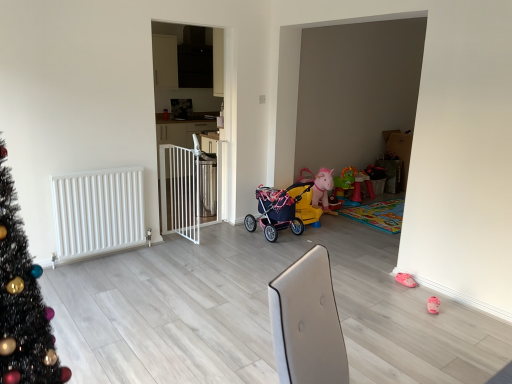
Measure the distance between matte pink stroller at center and camera.

matte pink stroller at center and camera are 4.18 meters apart.

Where is `matte pink stroller at center`? This screenshot has width=512, height=384. matte pink stroller at center is located at coordinates (283, 210).

What is the approximate width of white plastic gate at center?

The width of white plastic gate at center is 8.37 centimeters.

This screenshot has width=512, height=384. What do you see at coordinates (179, 192) in the screenshot?
I see `white plastic gate at center` at bounding box center [179, 192].

Image resolution: width=512 pixels, height=384 pixels. Describe the element at coordinates (305, 203) in the screenshot. I see `pink fabric baby carriage at center` at that location.

Identify the location of white matte radiator at left. (97, 212).

Is white matte radiator at left inside pink fabric baby carriage at center?

No, white matte radiator at left is not surrounded by pink fabric baby carriage at center.

Is point (298, 182) farther from camera compared to point (103, 224)?

Yes, it is.

Does pink fabric baby carriage at center appear on the left side of white matte radiator at left?

Incorrect, pink fabric baby carriage at center is not on the left side of white matte radiator at left.

Between white metal gate at center and matte pink stroller at center, which one appears on the left side from the viewer's perspective?

Positioned to the left is white metal gate at center.

Is white metal gate at center located outside matte pink stroller at center?

Yes.

Locate an element on the screen. The image size is (512, 384). toy below the white metal gate at center (from a real-world perspective) is located at coordinates (283, 210).

From a real-world perspective, which object rests below the other?

From a 3D spatial view, matte pink stroller at center is below.

Is matte pink stroller at center not close to pink fabric baby carriage at center?

No, there isn't a large distance between matte pink stroller at center and pink fabric baby carriage at center.

Would you say matte pink stroller at center is inside or outside pink fabric baby carriage at center?

matte pink stroller at center is not inside pink fabric baby carriage at center, it's outside.

From a real-world perspective, who is located higher, matte pink stroller at center or pink fabric baby carriage at center?

From a 3D spatial view, matte pink stroller at center is above.

Is pink fabric baby carriage at center at the right side of white plastic gate at center?

Indeed, pink fabric baby carriage at center is positioned on the right side of white plastic gate at center.

Which is more distant, (309, 221) or (168, 222)?

The point (309, 221) is farther.

Based on the photo, is pink fabric baby carriage at center positioned far away from white plastic gate at center?

Yes, pink fabric baby carriage at center and white plastic gate at center are quite far apart.

From the image's perspective, is white plastic gate at center under pink fabric baby carriage at center?

No, from the image's perspective, white plastic gate at center is not beneath pink fabric baby carriage at center.

Is point (198, 178) behind point (315, 225)?

No.

Who is taller, white plastic gate at center or pink fabric baby carriage at center?

white plastic gate at center is taller.

Based on the photo, is white plastic gate at center spatially inside pink fabric baby carriage at center, or outside of it?

The correct answer is: outside.

Is point (183, 146) positioned in front of point (184, 173)?

No, it is not.

From the image's perspective, which object appears higher, white metal gate at center or white plastic gate at center?

white metal gate at center.

Where is `screen door above the white plastic gate at center (from a real-world perspective)`? This screenshot has height=384, width=512. screen door above the white plastic gate at center (from a real-world perspective) is located at coordinates (188, 181).

From a real-world perspective, does white metal gate at center stand above white plastic gate at center?

Yes, from a real-world perspective, white metal gate at center is over white plastic gate at center

From the picture: Is white metal gate at center surrounded by pink fabric baby carriage at center?

No, white metal gate at center is not inside pink fabric baby carriage at center.

Is pink fabric baby carriage at center in front of white metal gate at center?

No, it is not.

Is pink fabric baby carriage at center turned away from white metal gate at center?

No, pink fabric baby carriage at center is not facing the opposite direction of white metal gate at center.

Is pink fabric baby carriage at center not near white metal gate at center?

Yes, pink fabric baby carriage at center and white metal gate at center are located far from each other.

Identify the location of radiator that is above the pink fabric baby carriage at center (from a real-world perspective). (97, 212).

The image size is (512, 384). I want to click on toy behind the white metal gate at center, so click(x=283, y=210).

Based on their spatial positions, is white matte radiator at left or matte pink stroller at center closer to white metal gate at center?

Among the two, matte pink stroller at center is located nearer to white metal gate at center.

Estimate the real-world distances between objects in this image. Which object is closer to pink fabric baby carriage at center, white metal gate at center or matte pink stroller at center?

Based on the image, matte pink stroller at center appears to be nearer to pink fabric baby carriage at center.

Considering their positions, is pink fabric baby carriage at center positioned further to white metal gate at center than white plastic gate at center?

pink fabric baby carriage at center lies further to white metal gate at center than the other object.

Considering their positions, is white matte radiator at left positioned closer to pink fabric baby carriage at center than matte pink stroller at center?

matte pink stroller at center lies closer to pink fabric baby carriage at center than the other object.

Based on their spatial positions, is matte pink stroller at center or white matte radiator at left closer to white plastic gate at center?

white matte radiator at left is closer to white plastic gate at center.

Looking at the image, which one is located closer to white matte radiator at left, white metal gate at center or matte pink stroller at center?

matte pink stroller at center is closer to white matte radiator at left.

Estimate the real-world distances between objects in this image. Which object is further from pink fabric baby carriage at center, white plastic gate at center or white matte radiator at left?

white matte radiator at left is positioned further to the anchor pink fabric baby carriage at center.

Looking at the image, which one is located further to white metal gate at center, matte pink stroller at center or white plastic gate at center?

matte pink stroller at center is further to white metal gate at center.

Locate an element on the screen. This screenshot has height=384, width=512. toy between white matte radiator at left and pink fabric baby carriage at center in the horizontal direction is located at coordinates [x=283, y=210].

This screenshot has width=512, height=384. Find the location of `screen door between white plastic gate at center and pink fabric baby carriage at center from left to right`. screen door between white plastic gate at center and pink fabric baby carriage at center from left to right is located at coordinates (188, 181).

Image resolution: width=512 pixels, height=384 pixels. I want to click on screen door between white matte radiator at left and matte pink stroller at center from left to right, so click(188, 181).

Where is `balustrade between white matte radiator at left and matte pink stroller at center from left to right`? The width and height of the screenshot is (512, 384). balustrade between white matte radiator at left and matte pink stroller at center from left to right is located at coordinates (179, 192).